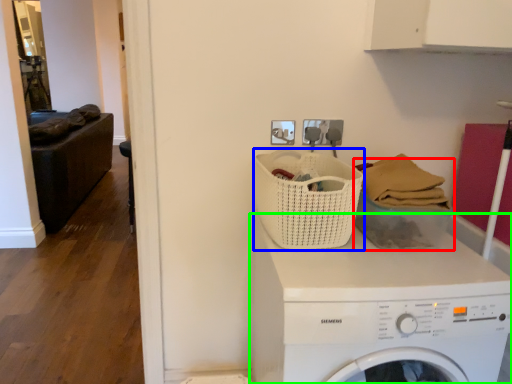
Question: Which is farther away from basket (highlighted by a red box)? basket (highlighted by a blue box) or washing machine (highlighted by a green box)?

Choices:
 (A) basket
 (B) washing machine

Answer: (B)